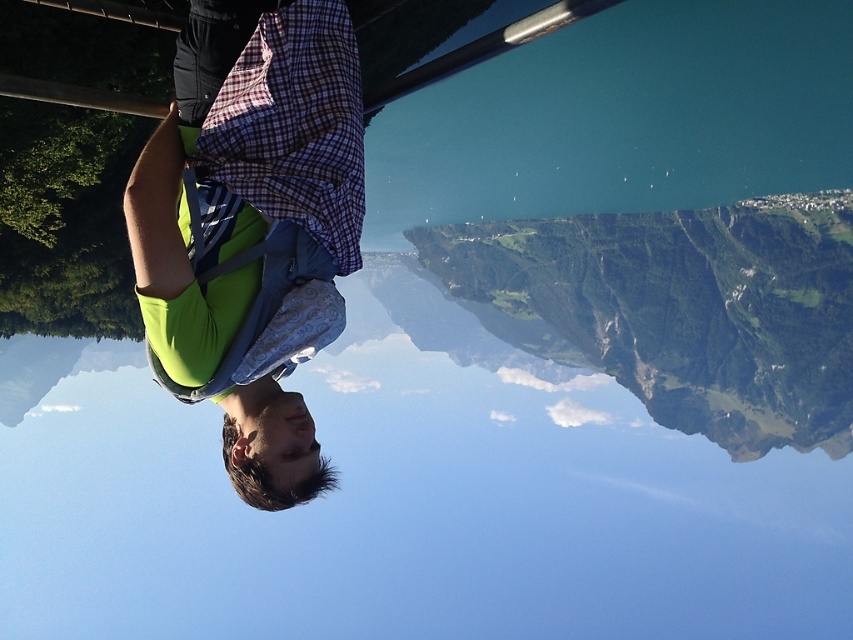
Is green fabric shirt at upper left bigger than green grassy mountain at upper right?

No.

Does point (202, 202) come farther from viewer compared to point (720, 376)?

That is False.

Which is in front, point (221, 305) or point (756, 330)?

Point (221, 305) is in front.

I want to click on green fabric shirt at upper left, so click(x=251, y=228).